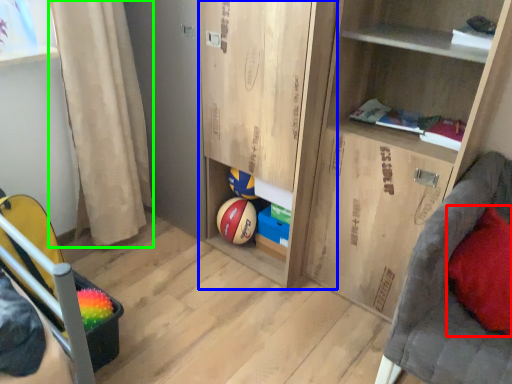
Question: Based on their relative distances, which object is nearer to pillow (highlighted by a red box)? Choose from cabinet (highlighted by a blue box) and curtain (highlighted by a green box).

Choices:
 (A) cabinet
 (B) curtain

Answer: (A)